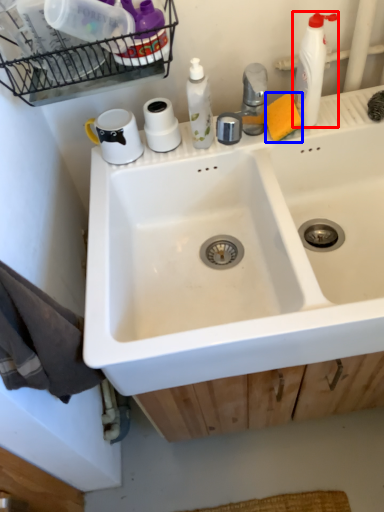
Question: Among these objects, which one is nearest to the camera, cleaning product (highlighted by a red box) or soap (highlighted by a blue box)?

Choices:
 (A) cleaning product
 (B) soap

Answer: (A)